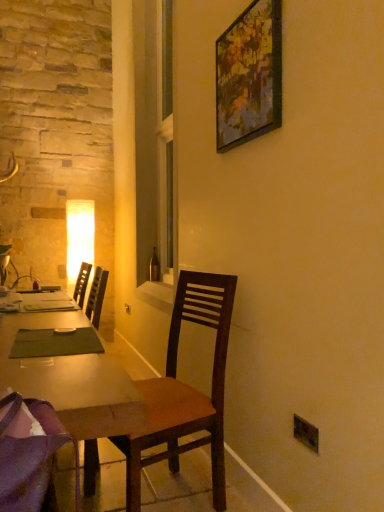
Question: Considering the positions of wooden picture frame at upper center and wooden chair at center, the first chair viewed from the back, in the image, is wooden picture frame at upper center wider or thinner than wooden chair at center, the first chair viewed from the back,?

Choices:
 (A) thin
 (B) wide

Answer: (A)

Question: From a real-world perspective, is wooden picture frame at upper center above or below wooden chair at center, the second chair viewed from the front?

Choices:
 (A) above
 (B) below

Answer: (A)

Question: Which object is the farthest from the wooden desk at center?

Choices:
 (A) brown glass bottle at center
 (B) purple fabric chair at lower left, which ranks as the 2th chair in back-to-front order
 (C) clear glass window at center
 (D) wooden picture frame at upper center
 (E) black plastic power outlet at lower right

Answer: (E)

Question: Estimate the real-world distances between objects in this image. Which object is farther from the black plastic power outlet at lower right?

Choices:
 (A) purple fabric chair at lower left, which is the first chair from front to back
 (B) clear glass window at center
 (C) wooden desk at center
 (D) wooden chair at center, the second chair viewed from the front
 (E) wooden picture frame at upper center

Answer: (A)